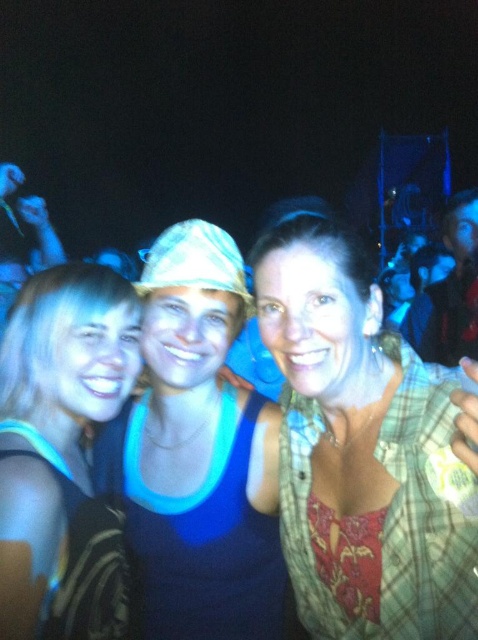
You are taking a photo of three people at night. The scene has a person on the left in a sleeveless top, a person in the center wearing a blue tank top and cap, and a person on the right in a plaid shirt over a red floral top. A point at coordinates (365, 449) marks the plaid fabric shirt at center. Based on this, which person is wearing the plaid shirt?

The point at (365, 449) marks the plaid fabric shirt at center, so the person in the center is wearing the plaid shirt.

You are a photographer trying to capture a clear photo of the plaid fabric shirt at center and the blue fabric tank top at center. The camera has a minimum focus distance of 10 inches. Will the camera be able to focus on both objects?

The plaid fabric shirt at center is 9.07 inches away from blue fabric tank top at center. Since the distance between them is less than the camera minimum focus distance of 10 inches, the camera may not be able to focus on both objects clearly.

You are a photographer trying to adjust the lighting for a group photo. You notice the blue fabric tank top at center and the blonde hair at left. Which object is closer to you, the photographer?

The blue fabric tank top at center is closer to you than the blonde hair at left because it is further to the viewer.